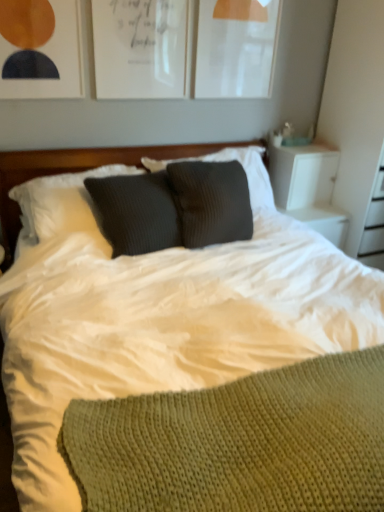
Where is `matte white picture frame at upper center, the 3th picture frame viewed from the left`? This screenshot has height=512, width=384. matte white picture frame at upper center, the 3th picture frame viewed from the left is located at coordinates (236, 48).

The height and width of the screenshot is (512, 384). What do you see at coordinates (236, 48) in the screenshot?
I see `matte white picture frame at upper center, which is the 1th picture frame from right to left` at bounding box center [236, 48].

This screenshot has height=512, width=384. Describe the element at coordinates (141, 48) in the screenshot. I see `white paper at upper center, which is the 2th picture frame in left-to-right order` at that location.

What do you see at coordinates (40, 49) in the screenshot? This screenshot has width=384, height=512. I see `matte white picture frame at upper left, which is the 1th picture frame in left-to-right order` at bounding box center [40, 49].

Find the location of `matte white picture frame at upper left, which is the 1th picture frame in left-to-right order`. matte white picture frame at upper left, which is the 1th picture frame in left-to-right order is located at coordinates (40, 49).

The width and height of the screenshot is (384, 512). I want to click on matte white picture frame at upper center, which is the 1th picture frame from right to left, so click(236, 48).

Is the depth of woolen dark gray pillow at center less than that of white paper at upper center, which is the 2th picture frame in left-to-right order?

Yes, woolen dark gray pillow at center is closer to the viewer.

From a real-world perspective, relative to white paper at upper center, which is the 2th picture frame in left-to-right order, is woolen dark gray pillow at center vertically above or below?

woolen dark gray pillow at center is situated lower than white paper at upper center, which is the 2th picture frame in left-to-right order, in the real world.

Is woolen dark gray pillow at center taller than white paper at upper center, placed as the 2th picture frame when sorted from right to left?

In fact, woolen dark gray pillow at center may be shorter than white paper at upper center, placed as the 2th picture frame when sorted from right to left.

Which of these two, woolen dark gray pillow at center or white paper at upper center, placed as the 2th picture frame when sorted from right to left, is bigger?

woolen dark gray pillow at center is bigger.

From the image's perspective, which is above, matte white picture frame at upper left, which ranks as the third picture frame in right-to-left order, or white soft bedding at center?

From the image's view, matte white picture frame at upper left, which ranks as the third picture frame in right-to-left order, is above.

Is matte white picture frame at upper left, which is the 1th picture frame in left-to-right order, not within white soft bedding at center?

Yes.

Is matte white picture frame at upper left, which ranks as the third picture frame in right-to-left order, not close to white soft bedding at center?

Yes.

Does matte white picture frame at upper left, which is the 1th picture frame in left-to-right order, appear on the left side of white soft bedding at center?

Yes, matte white picture frame at upper left, which is the 1th picture frame in left-to-right order, is to the left of white soft bedding at center.

Between white soft bedding at center and matte white picture frame at upper left, which is the 1th picture frame in left-to-right order, which one has smaller size?

matte white picture frame at upper left, which is the 1th picture frame in left-to-right order.

Is white soft bedding at center not within matte white picture frame at upper left, which ranks as the third picture frame in right-to-left order?

Yes, white soft bedding at center is located beyond the bounds of matte white picture frame at upper left, which ranks as the third picture frame in right-to-left order.

From the image's perspective, which is below, white soft bedding at center or matte white picture frame at upper left, which is the 1th picture frame in left-to-right order?

white soft bedding at center.

Considering the positions of points (45, 452) and (46, 75), is point (45, 452) closer to camera compared to point (46, 75)?

Yes, point (45, 452) is in front of point (46, 75).

Who is bigger, matte white picture frame at upper center, the 3th picture frame viewed from the left, or white paper at upper center, which is the 2th picture frame in left-to-right order?

With larger size is matte white picture frame at upper center, the 3th picture frame viewed from the left.

Is matte white picture frame at upper center, which is the 1th picture frame from right to left, aimed at white paper at upper center, placed as the 2th picture frame when sorted from right to left?

No.

Looking at their sizes, would you say matte white picture frame at upper center, which is the 1th picture frame from right to left, is wider or thinner than white paper at upper center, which is the 2th picture frame in left-to-right order?

In the image, matte white picture frame at upper center, which is the 1th picture frame from right to left, appears to be wider than white paper at upper center, which is the 2th picture frame in left-to-right order.

From a real-world perspective, is matte white picture frame at upper center, which is the 1th picture frame from right to left, under white paper at upper center, which is the 2th picture frame in left-to-right order?

Incorrect, from a real-world perspective, matte white picture frame at upper center, which is the 1th picture frame from right to left, is higher than white paper at upper center, which is the 2th picture frame in left-to-right order.

From the image's perspective, who appears lower, woolen dark gray pillow at center or matte white picture frame at upper left, which is the 1th picture frame in left-to-right order?

woolen dark gray pillow at center is shown below in the image.

Is woolen dark gray pillow at center directly adjacent to matte white picture frame at upper left, which ranks as the third picture frame in right-to-left order?

No, woolen dark gray pillow at center is not touching matte white picture frame at upper left, which ranks as the third picture frame in right-to-left order.

Is woolen dark gray pillow at center inside the boundaries of matte white picture frame at upper left, which ranks as the third picture frame in right-to-left order, or outside?

woolen dark gray pillow at center is outside matte white picture frame at upper left, which ranks as the third picture frame in right-to-left order.

Based on the photo, is woolen dark gray pillow at center facing away from matte white picture frame at upper left, which ranks as the third picture frame in right-to-left order?

woolen dark gray pillow at center does not have its back to matte white picture frame at upper left, which ranks as the third picture frame in right-to-left order.

Consider the image. Does white soft bedding at center appear on the right side of white paper at upper center, which is the 2th picture frame in left-to-right order?

Yes.

Between white soft bedding at center and white paper at upper center, which is the 2th picture frame in left-to-right order, which one has larger width?

Wider between the two is white soft bedding at center.

Where is `bed that is in front of the white paper at upper center, placed as the 2th picture frame when sorted from right to left`? The image size is (384, 512). bed that is in front of the white paper at upper center, placed as the 2th picture frame when sorted from right to left is located at coordinates (161, 324).

Which is nearer, (135,167) or (65,254)?

Point (135,167).

Is woolen dark gray pillow at center taller or shorter than white soft bedding at center?

woolen dark gray pillow at center is shorter than white soft bedding at center.

Is there a large distance between woolen dark gray pillow at center and white soft bedding at center?

They are positioned close to each other.

This screenshot has height=512, width=384. Find the location of `pillow directly beneath the white paper at upper center, which is the 2th picture frame in left-to-right order (from a real-world perspective)`. pillow directly beneath the white paper at upper center, which is the 2th picture frame in left-to-right order (from a real-world perspective) is located at coordinates click(x=62, y=201).

Find the location of a particular element. bed located on the right of matte white picture frame at upper left, which ranks as the third picture frame in right-to-left order is located at coordinates (161, 324).

Estimate the real-world distances between objects in this image. Which object is further from matte white picture frame at upper left, which ranks as the third picture frame in right-to-left order, white soft bedding at center or matte white picture frame at upper center, which is the 1th picture frame from right to left?

Based on the image, white soft bedding at center appears to be further to matte white picture frame at upper left, which ranks as the third picture frame in right-to-left order.

From the image, which object appears to be farther from woolen dark gray pillow at center, white soft bedding at center or matte white picture frame at upper center, which is the 1th picture frame from right to left?

matte white picture frame at upper center, which is the 1th picture frame from right to left.

From the image, which object appears to be nearer to woolen dark gray pillow at center, white paper at upper center, placed as the 2th picture frame when sorted from right to left, or matte white picture frame at upper left, which ranks as the third picture frame in right-to-left order?

matte white picture frame at upper left, which ranks as the third picture frame in right-to-left order, is positioned closer to the anchor woolen dark gray pillow at center.

From the image, which object appears to be nearer to white soft bedding at center, matte white picture frame at upper center, the 3th picture frame viewed from the left, or white paper at upper center, placed as the 2th picture frame when sorted from right to left?

white paper at upper center, placed as the 2th picture frame when sorted from right to left, is positioned closer to the anchor white soft bedding at center.

Estimate the real-world distances between objects in this image. Which object is further from white paper at upper center, placed as the 2th picture frame when sorted from right to left, woolen dark gray pillow at center or matte white picture frame at upper left, which is the 1th picture frame in left-to-right order?

woolen dark gray pillow at center is further to white paper at upper center, placed as the 2th picture frame when sorted from right to left.

From the image, which object appears to be nearer to white soft bedding at center, matte white picture frame at upper left, which ranks as the third picture frame in right-to-left order, or white paper at upper center, which is the 2th picture frame in left-to-right order?

matte white picture frame at upper left, which ranks as the third picture frame in right-to-left order, is positioned closer to the anchor white soft bedding at center.

When comparing their distances from matte white picture frame at upper left, which is the 1th picture frame in left-to-right order, does white paper at upper center, placed as the 2th picture frame when sorted from right to left, or white soft bedding at center seem further?

white soft bedding at center.

Which object lies further to the anchor point white paper at upper center, which is the 2th picture frame in left-to-right order, matte white picture frame at upper center, the 3th picture frame viewed from the left, or white soft bedding at center?

white soft bedding at center is further to white paper at upper center, which is the 2th picture frame in left-to-right order.

Locate an element on the screen. picture frame that lies between white paper at upper center, which is the 2th picture frame in left-to-right order, and woolen dark gray pillow at center from top to bottom is located at coordinates pyautogui.click(x=40, y=49).

The image size is (384, 512). I want to click on pillow between matte white picture frame at upper left, which ranks as the third picture frame in right-to-left order, and matte white picture frame at upper center, the 3th picture frame viewed from the left, so click(x=62, y=201).

Locate an element on the screen. picture frame between white soft bedding at center and white paper at upper center, which is the 2th picture frame in left-to-right order, in the front-back direction is located at coordinates (40, 49).

This screenshot has height=512, width=384. I want to click on pillow positioned between white soft bedding at center and matte white picture frame at upper left, which ranks as the third picture frame in right-to-left order, from near to far, so click(x=62, y=201).